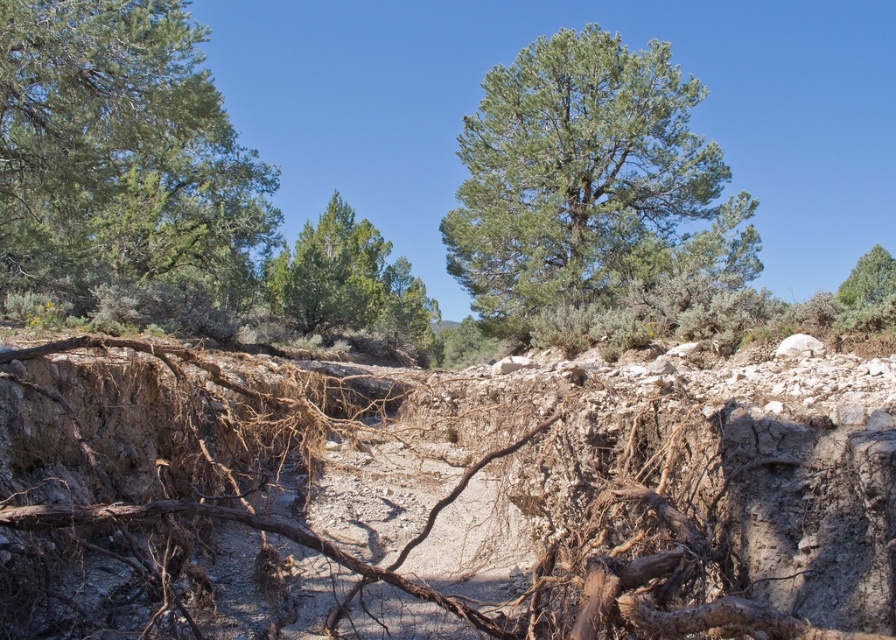
Question: Where is green needle-like at upper left located in relation to green leafy tree at upper right in the image?

Choices:
 (A) above
 (B) below

Answer: (A)

Question: Which point is closer to the camera?

Choices:
 (A) green leafy tree at center
 (B) green needle-like at upper left
 (C) green textured tree at center
 (D) green leafy tree at upper right

Answer: (D)

Question: From the image, what is the correct spatial relationship of green needle-like at upper left in relation to green leafy tree at center?

Choices:
 (A) right
 (B) left

Answer: (B)

Question: Can you confirm if green needle-like at upper left is positioned above green leafy tree at center?

Choices:
 (A) yes
 (B) no

Answer: (A)

Question: Which point is closer to the camera taking this photo?

Choices:
 (A) (635, 147)
 (B) (293, 321)

Answer: (A)

Question: Which object is the farthest from the green needle-like at upper left?

Choices:
 (A) green leafy tree at upper right
 (B) green textured tree at center
 (C) green leafy tree at center

Answer: (A)